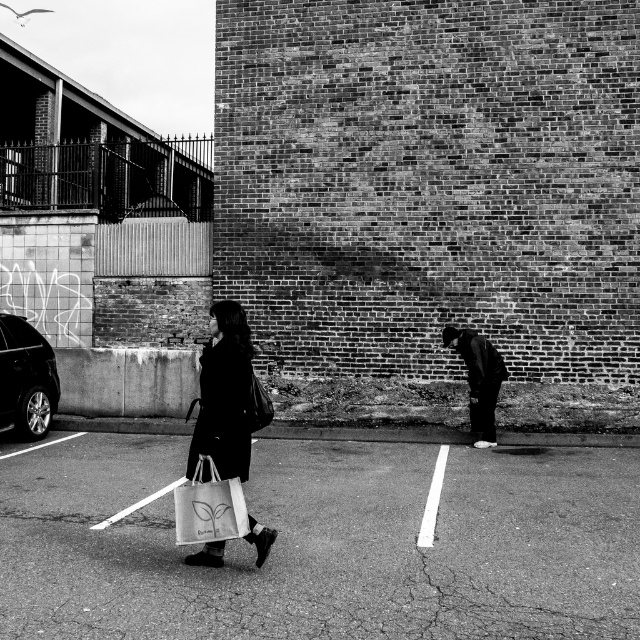
Question: Which object is closer to the camera taking this photo?

Choices:
 (A) smooth asphalt parking lot at center
 (B) shiny metallic car at left

Answer: (A)

Question: Which point is farther from the camera taking this photo?

Choices:
 (A) [22, 323]
 (B) [340, 467]

Answer: (A)

Question: Can you confirm if white canvas bag at center is positioned below black matte jacket at right?

Choices:
 (A) no
 (B) yes

Answer: (B)

Question: Which of the following is the closest to the observer?

Choices:
 (A) (486, 412)
 (B) (204, 532)
 (C) (36, 356)

Answer: (B)

Question: Is smooth asphalt parking lot at center smaller than shiny metallic car at left?

Choices:
 (A) yes
 (B) no

Answer: (B)

Question: Can you confirm if smooth asphalt parking lot at center is positioned below white canvas bag at center?

Choices:
 (A) no
 (B) yes

Answer: (B)